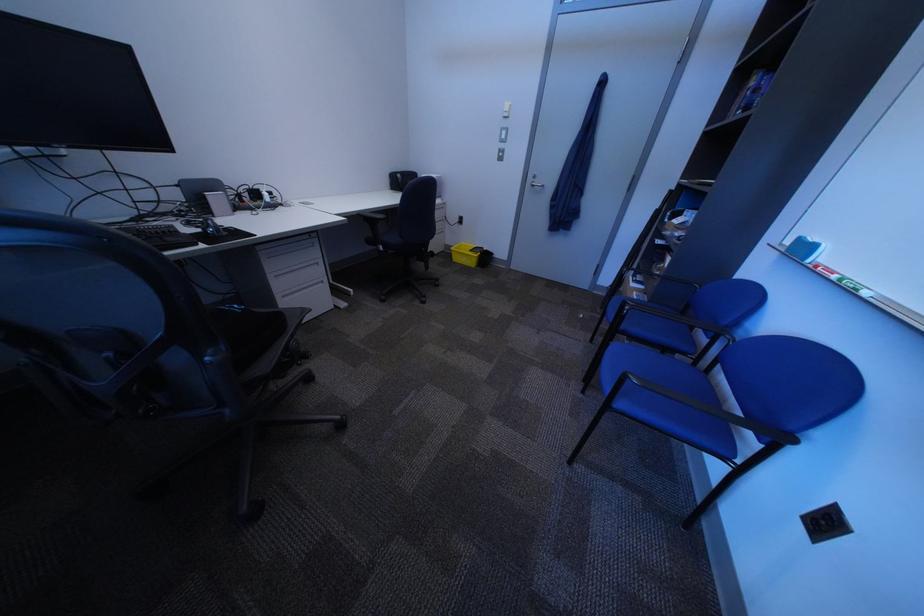
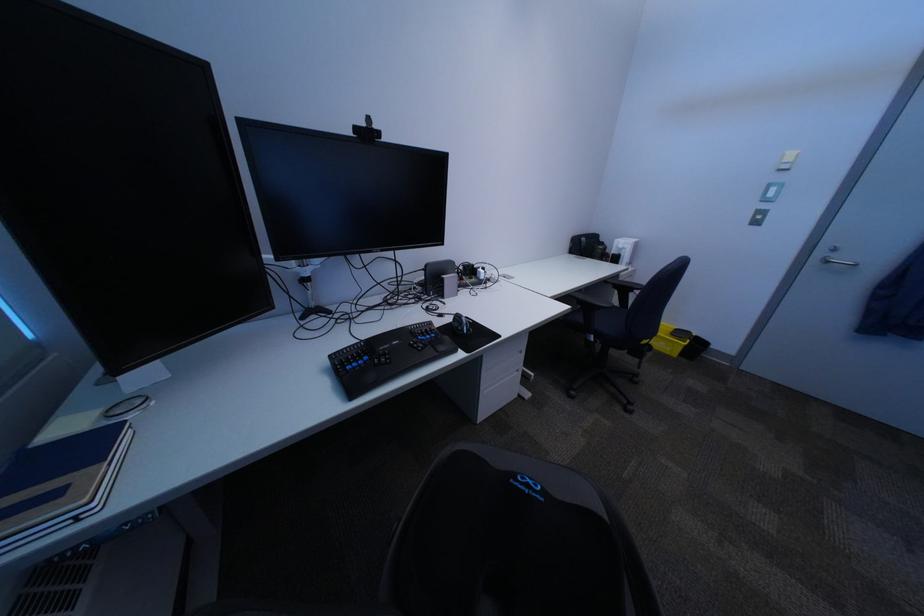
Question: Based on the continuous images, in which direction is the camera rotating? Reply with the corresponding letter.

Choices:
 (A) Left
 (B) Right
 (C) Up
 (D) Down

Answer: (A)